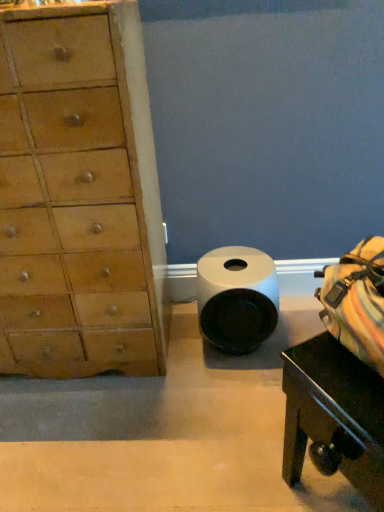
This screenshot has height=512, width=384. I want to click on vacant area that lies between light brown wood chest of drawers at left and white matte toilet paper at center, so click(186, 352).